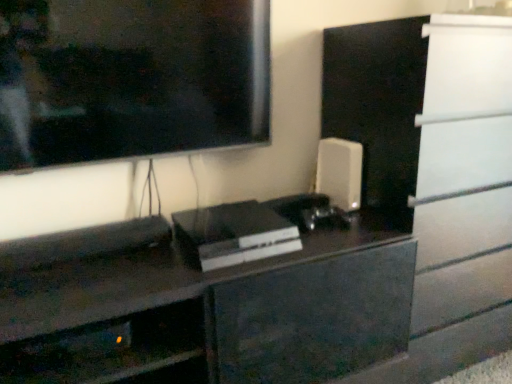
The image size is (512, 384). What do you see at coordinates (340, 172) in the screenshot?
I see `white matte speaker at right, which is counted as the 2th appliance, starting from the front` at bounding box center [340, 172].

Identify the location of metallic gray shelf at lower left. The height and width of the screenshot is (384, 512). (115, 351).

Identify the location of white matte speaker at right, which is counted as the 2th appliance, starting from the front. The width and height of the screenshot is (512, 384). (340, 172).

Is white matte speaker at right, marked as the second appliance in a left-to-right arrangement, looking in the opposite direction of metallic gray shelf at lower left?

white matte speaker at right, marked as the second appliance in a left-to-right arrangement, is not turned away from metallic gray shelf at lower left.

From a real-world perspective, is white matte speaker at right, marked as the second appliance in a left-to-right arrangement, positioned over metallic gray shelf at lower left based on gravity?

Yes, from a real-world perspective, white matte speaker at right, marked as the second appliance in a left-to-right arrangement, is above metallic gray shelf at lower left.

Considering the relative positions of white matte speaker at right, marked as the second appliance in a left-to-right arrangement, and metallic gray shelf at lower left in the image provided, is white matte speaker at right, marked as the second appliance in a left-to-right arrangement, to the left or to the right of metallic gray shelf at lower left?

white matte speaker at right, marked as the second appliance in a left-to-right arrangement, is to the right of metallic gray shelf at lower left.

In the scene shown: Are white matte speaker at right, the first appliance from the back, and metallic gray shelf at lower left making contact?

No, white matte speaker at right, the first appliance from the back, is not touching metallic gray shelf at lower left.

Is metallic gray shelf at lower left facing towards sleek black console at center, the 2th appliance in the right-to-left sequence?

No, metallic gray shelf at lower left is not oriented towards sleek black console at center, the 2th appliance in the right-to-left sequence.

Between metallic gray shelf at lower left and sleek black console at center, arranged as the 1th appliance when viewed from the left, which one has smaller width?

Thinner between the two is metallic gray shelf at lower left.

Could sleek black console at center, arranged as the 1th appliance when viewed from the left, be considered to be inside metallic gray shelf at lower left?

Definitely not — sleek black console at center, arranged as the 1th appliance when viewed from the left, is not inside metallic gray shelf at lower left.

Is point (193, 338) closer or farther from the camera than point (210, 239)?

Point (193, 338) is positioned closer to the camera compared to point (210, 239).

How many degrees apart are the facing directions of metallic gray shelf at lower left and white matte speaker at right, the first appliance from the back?

The angle between the facing direction of metallic gray shelf at lower left and the facing direction of white matte speaker at right, the first appliance from the back, is 7.88 degrees.

Considering the sizes of objects metallic gray shelf at lower left and white matte speaker at right, marked as the second appliance in a left-to-right arrangement, in the image provided, who is bigger, metallic gray shelf at lower left or white matte speaker at right, marked as the second appliance in a left-to-right arrangement,?

Bigger between the two is metallic gray shelf at lower left.

Which object is positioned more to the right, metallic gray shelf at lower left or white matte speaker at right, which appears as the 1th appliance when viewed from the right?

white matte speaker at right, which appears as the 1th appliance when viewed from the right.

Is metallic gray shelf at lower left completely or partially outside of white matte speaker at right, the first appliance from the back?

Yes, metallic gray shelf at lower left is located beyond the bounds of white matte speaker at right, the first appliance from the back.

Is white matte speaker at right, which is counted as the 2th appliance, starting from the front, thinner than sleek black console at center, which appears as the 2th appliance when viewed from the back?

Yes, white matte speaker at right, which is counted as the 2th appliance, starting from the front, is thinner than sleek black console at center, which appears as the 2th appliance when viewed from the back.

Is white matte speaker at right, which appears as the 1th appliance when viewed from the right, far away from sleek black console at center, which appears as the 2th appliance when viewed from the back?

Actually, white matte speaker at right, which appears as the 1th appliance when viewed from the right, and sleek black console at center, which appears as the 2th appliance when viewed from the back, are a little close together.

Could you tell me if white matte speaker at right, which is counted as the 2th appliance, starting from the front, is turned towards sleek black console at center, arranged as the 1th appliance when viewed from the left?

No, white matte speaker at right, which is counted as the 2th appliance, starting from the front, is not turned towards sleek black console at center, arranged as the 1th appliance when viewed from the left.

Locate an element on the screen. appliance in front of the white matte speaker at right, marked as the second appliance in a left-to-right arrangement is located at coordinates (234, 233).

Which is in front, sleek black console at center, arranged as the 1th appliance when viewed from the left, or metallic gray shelf at lower left?

metallic gray shelf at lower left is in front.

How much distance is there between sleek black console at center, the first appliance positioned from the front, and metallic gray shelf at lower left?

A distance of 18.56 inches exists between sleek black console at center, the first appliance positioned from the front, and metallic gray shelf at lower left.

Can you confirm if sleek black console at center, the first appliance positioned from the front, is wider than metallic gray shelf at lower left?

Yes.

Is sleek black console at center, arranged as the 1th appliance when viewed from the left, bigger than metallic gray shelf at lower left?

Indeed, sleek black console at center, arranged as the 1th appliance when viewed from the left, has a larger size compared to metallic gray shelf at lower left.

Consider the image. Between sleek black console at center, the 2th appliance in the right-to-left sequence, and white matte speaker at right, marked as the second appliance in a left-to-right arrangement, which one has smaller width?

white matte speaker at right, marked as the second appliance in a left-to-right arrangement.

Considering the sizes of objects sleek black console at center, the 2th appliance in the right-to-left sequence, and white matte speaker at right, the first appliance from the back, in the image provided, who is smaller, sleek black console at center, the 2th appliance in the right-to-left sequence, or white matte speaker at right, the first appliance from the back,?

With smaller size is white matte speaker at right, the first appliance from the back.

From a real-world perspective, is sleek black console at center, the 2th appliance in the right-to-left sequence, above or below white matte speaker at right, marked as the second appliance in a left-to-right arrangement?

Clearly, from a real-world perspective, sleek black console at center, the 2th appliance in the right-to-left sequence, is below white matte speaker at right, marked as the second appliance in a left-to-right arrangement.

From the image's perspective, who appears lower, sleek black console at center, arranged as the 1th appliance when viewed from the left, or white matte speaker at right, which is counted as the 2th appliance, starting from the front?

sleek black console at center, arranged as the 1th appliance when viewed from the left, appears lower in the image.

This screenshot has width=512, height=384. I want to click on appliance that is the 2nd object located above the metallic gray shelf at lower left (from the image's perspective), so click(x=340, y=172).

This screenshot has width=512, height=384. What are the coordinates of `shelf below the sleek black console at center, the 2th appliance in the right-to-left sequence (from a real-world perspective)` in the screenshot? It's located at (115, 351).

Looking at the image, which one is located further to sleek black console at center, the first appliance positioned from the front, white matte speaker at right, which appears as the 1th appliance when viewed from the right, or metallic gray shelf at lower left?

metallic gray shelf at lower left is positioned further to the anchor sleek black console at center, the first appliance positioned from the front.

Looking at the image, which one is located closer to metallic gray shelf at lower left, white matte speaker at right, which appears as the 1th appliance when viewed from the right, or sleek black console at center, the first appliance positioned from the front?

sleek black console at center, the first appliance positioned from the front, is positioned closer to the anchor metallic gray shelf at lower left.

When comparing their distances from sleek black console at center, arranged as the 1th appliance when viewed from the left, does metallic gray shelf at lower left or white matte speaker at right, which appears as the 1th appliance when viewed from the right, seem further?

Among the two, metallic gray shelf at lower left is located further to sleek black console at center, arranged as the 1th appliance when viewed from the left.

Based on their spatial positions, is sleek black console at center, the 2th appliance in the right-to-left sequence, or white matte speaker at right, the first appliance from the back, further from metallic gray shelf at lower left?

Based on the image, white matte speaker at right, the first appliance from the back, appears to be further to metallic gray shelf at lower left.

From the image, which object appears to be farther from white matte speaker at right, which appears as the 1th appliance when viewed from the right, metallic gray shelf at lower left or sleek black console at center, the 2th appliance in the right-to-left sequence?

metallic gray shelf at lower left is further to white matte speaker at right, which appears as the 1th appliance when viewed from the right.

When comparing their distances from white matte speaker at right, which appears as the 1th appliance when viewed from the right, does sleek black console at center, arranged as the 1th appliance when viewed from the left, or metallic gray shelf at lower left seem closer?

sleek black console at center, arranged as the 1th appliance when viewed from the left, is positioned closer to the anchor white matte speaker at right, which appears as the 1th appliance when viewed from the right.

Locate an element on the screen. appliance located between metallic gray shelf at lower left and white matte speaker at right, marked as the second appliance in a left-to-right arrangement, in the left-right direction is located at coordinates (234, 233).